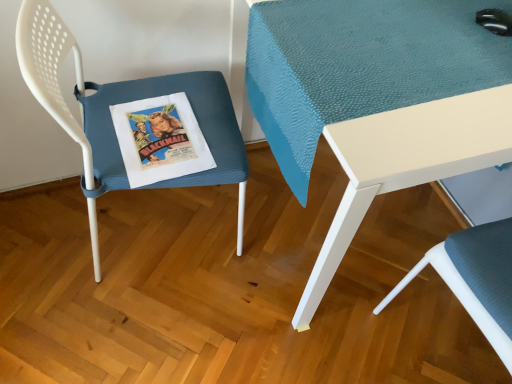
This screenshot has height=384, width=512. What are the coordinates of `vacant space that's between textured blue cushion at lower right, placed as the second chair when sorted from left to right, and teal fabric table at center` in the screenshot? It's located at (351, 349).